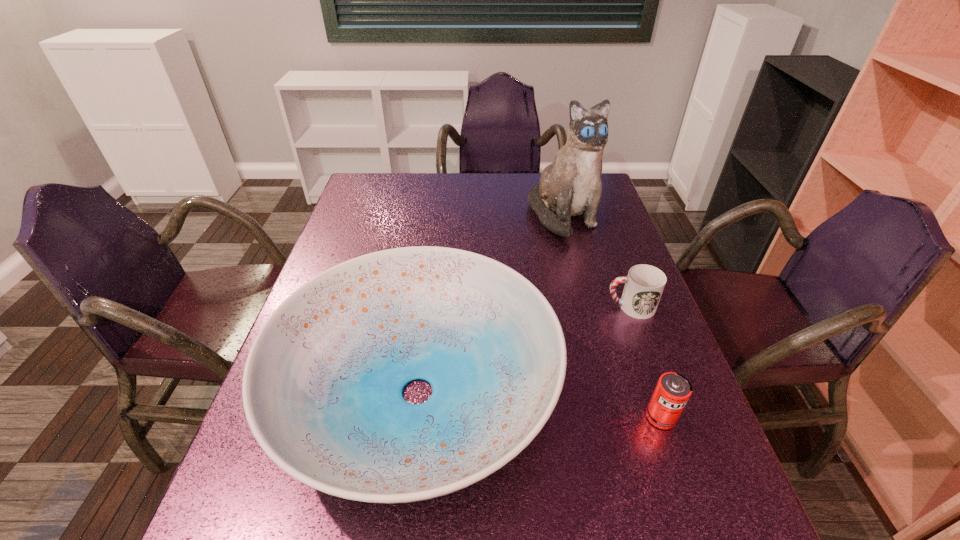
Identify the location of vacant area in the image that satisfies the following two spatial constraints: 1. at the face of the cat; 2. on the handle side of the cup. (587, 307).

Locate an element on the screen. Image resolution: width=960 pixels, height=540 pixels. blank area in the image that satisfies the following two spatial constraints: 1. at the face of the cat; 2. on the left side of the can is located at coordinates (614, 417).

At what (x,y) coordinates should I click in order to perform the action: click on vacant area that satisfies the following two spatial constraints: 1. on the handle side of the cup; 2. at the face of the cat. Please return your answer as a coordinate pair (x, y). Looking at the image, I should click on (597, 215).

The image size is (960, 540). I want to click on blank space that satisfies the following two spatial constraints: 1. at the face of the tallest object; 2. on the handle side of the cup, so 587,307.